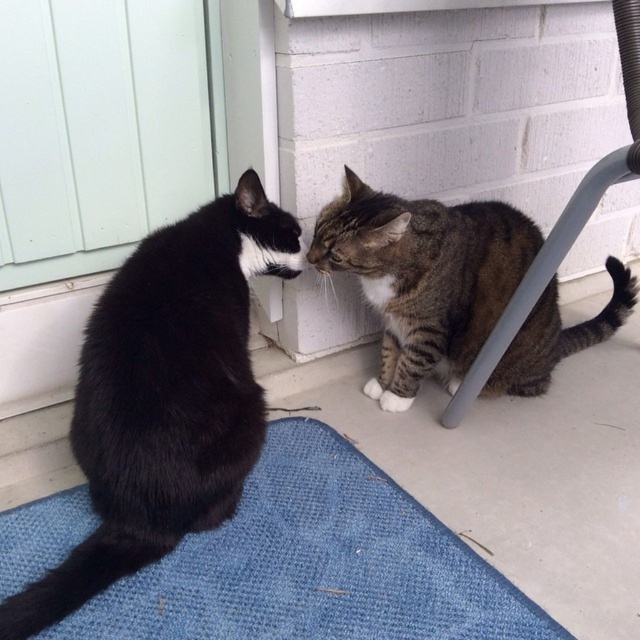
You are a delivery person trying to enter through the white wood screen door at upper left. There is a black fur cat at left blocking your path. Can you walk around the cat without stepping on it?

The black fur cat at left is wider than the white wood screen door at upper left, so you might have difficulty walking around it without stepping on the cat since the cat is wider than the door.

You are standing on the porch and want to place a small plant pot between the two points marked as point (209,570) and point (60,570). Which point should the pot be closer to so that it appears closer to you?

The pot should be closer to point (209,570) because it is further to the camera than point (60,570), making it appear closer to you.

You are a small toy placed on the blue textured mat at lower center. You want to roll towards the black fur cat at left without moving off the mat. Is the space on the mat large enough for you to move freely towards the cat?

The blue textured mat at lower center occupies less space than the black fur cat at left, so the mat may not provide enough space for the toy to move freely towards the cat without going off the mat.